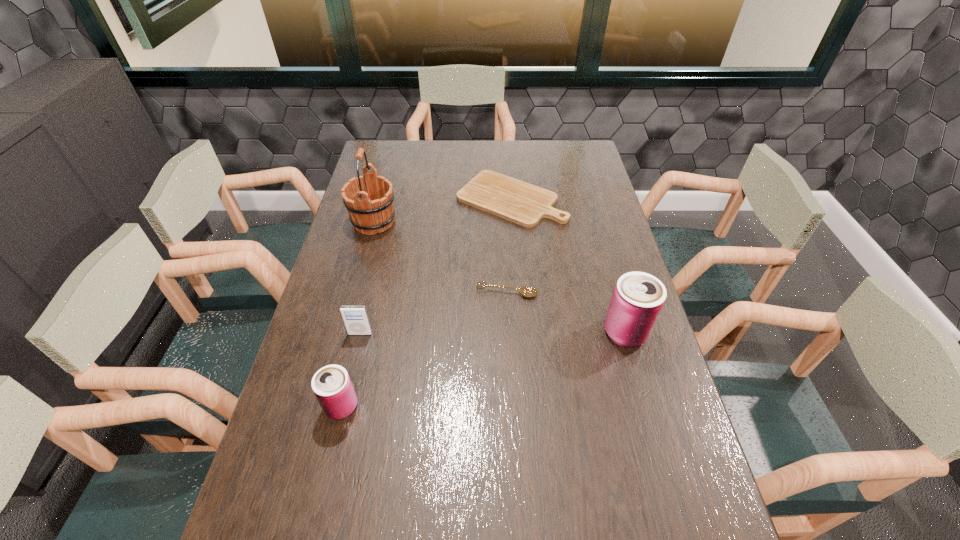
Locate an element on the screen. free space between the iPod and the shortest object is located at coordinates (436, 266).

Locate an element on the screen. The width and height of the screenshot is (960, 540). empty space that is in between the ladle and the tallest object is located at coordinates (441, 257).

You are a GUI agent. You are given a task and a screenshot of the screen. Output one action in this format:
    pyautogui.click(x=<x>, y=<y>)
    Task: Click on the free space between the third farthest object and the iPod
    The height and width of the screenshot is (540, 960).
    Given the screenshot: What is the action you would take?
    pyautogui.click(x=434, y=313)

Find the location of a particular element. The width and height of the screenshot is (960, 540). blank region between the wine bucket and the iPod is located at coordinates (367, 278).

At what (x,y) coordinates should I click in order to perform the action: click on free spot between the tallest object and the ladle. Please return your answer as a coordinate pair (x, y). Image resolution: width=960 pixels, height=540 pixels. Looking at the image, I should click on (441, 257).

Find the location of `vacant space in between the second shortest object and the nearest object`. vacant space in between the second shortest object and the nearest object is located at coordinates click(x=424, y=349).

Select which object is the closest to the nearer can. Please provide its 2D coordinates. Your answer should be formatted as a tuple, i.e. [(x, y)], where the tuple contains the x and y coordinates of a point satisfying the conditions above.

[(355, 318)]

You are a GUI agent. You are given a task and a screenshot of the screen. Output one action in this format:
    pyautogui.click(x=<x>, y=<y>)
    Task: Click on the object that stands as the third closest to the nearer can
    The height and width of the screenshot is (540, 960).
    Given the screenshot: What is the action you would take?
    pyautogui.click(x=373, y=212)